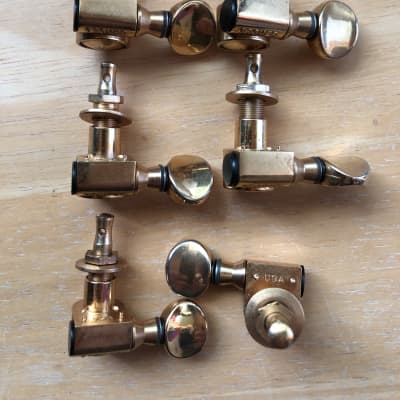
Locate an element on the screen. Image resolution: width=400 pixels, height=400 pixels. light stripe is located at coordinates (25, 69), (52, 178), (52, 369), (384, 307), (352, 383).